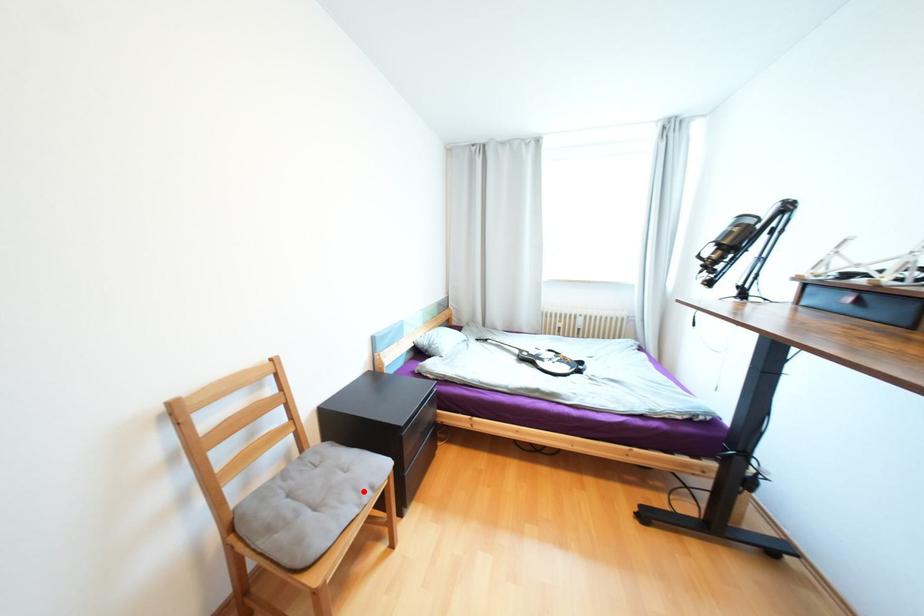
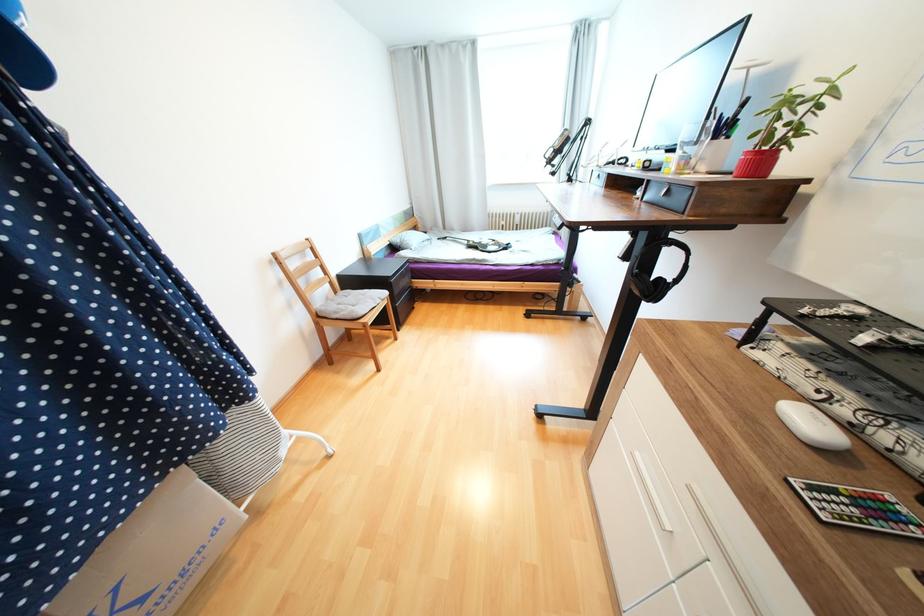
Question: I am providing you with two images of the same scene from different viewpoints. In image1, a red point is highlighted. Considering the same 3D point in image2, which of the following is correct?

Choices:
 (A) It is closer
 (B) It is farther

Answer: (A)